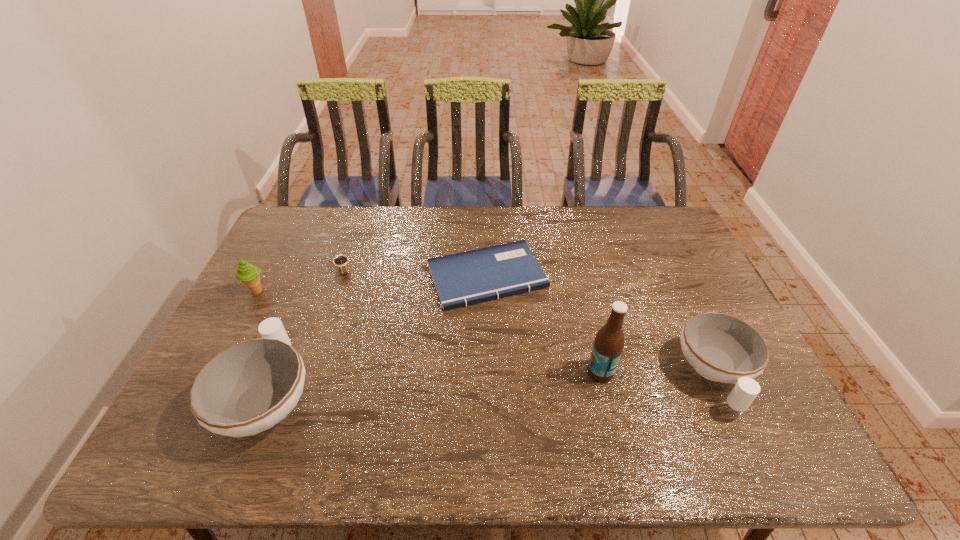
Identify the location of the third closest object to the fourth object from left to right. (251, 386).

Point out which object is positioned as the third nearest to the icecream. Please provide its 2D coordinates. Your answer should be formatted as a tuple, i.e. [(x, y)], where the tuple contains the x and y coordinates of a point satisfying the conditions above.

[(461, 279)]

The image size is (960, 540). I want to click on free region that satisfies the following two spatial constraints: 1. on the side with the handle of the beer bottle; 2. on the left side of the taller chinaware, so click(x=279, y=372).

Locate an element on the screen. vacant position in the image that satisfies the following two spatial constraints: 1. on the back side of the icecream; 2. on the right side of the third object from right to left is located at coordinates (264, 276).

You are a GUI agent. You are given a task and a screenshot of the screen. Output one action in this format:
    pyautogui.click(x=<x>, y=<y>)
    Task: Click on the free space that satisfies the following two spatial constraints: 1. on the side with the handle of the left chinaware; 2. on the left side of the watch
    The width and height of the screenshot is (960, 540).
    Given the screenshot: What is the action you would take?
    pyautogui.click(x=321, y=268)

The height and width of the screenshot is (540, 960). Identify the location of vacant space that satisfies the following two spatial constraints: 1. on the side with the handle of the taller chinaware; 2. on the left side of the tallest object. (279, 372).

Image resolution: width=960 pixels, height=540 pixels. Identify the location of free space in the image that satisfies the following two spatial constraints: 1. on the side with the handle of the taller chinaware; 2. on the left side of the watch. (321, 268).